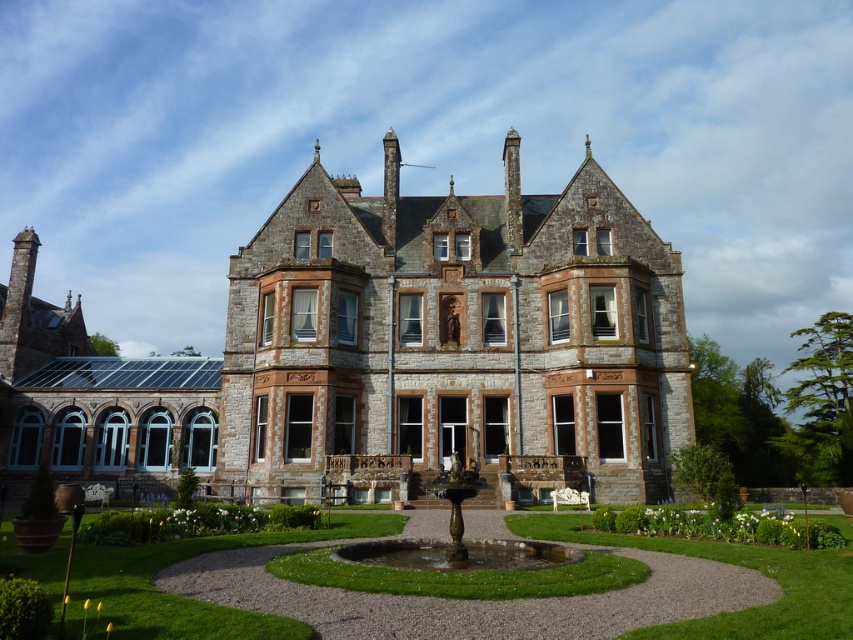
Which is behind, point (547, 368) or point (282, 534)?

The point (547, 368) is more distant.

Is point (386, 481) behind point (811, 636)?

Yes, it is.

Image resolution: width=853 pixels, height=640 pixels. I want to click on stone mansion at center, so click(x=381, y=353).

Is green grass at center taller than bronze metallic fountain at center?

Incorrect, green grass at center's height is not larger of bronze metallic fountain at center's.

Between green grass at center and bronze metallic fountain at center, which one appears on the left side from the viewer's perspective?

From the viewer's perspective, bronze metallic fountain at center appears more on the left side.

Is point (56, 570) positioned in front of point (430, 563)?

Yes.

I want to click on green grass at center, so click(x=190, y=598).

What do you see at coordinates (457, 540) in the screenshot? I see `bronze metallic fountain at center` at bounding box center [457, 540].

Locate an element on the screen. This screenshot has width=853, height=640. bronze metallic fountain at center is located at coordinates (457, 540).